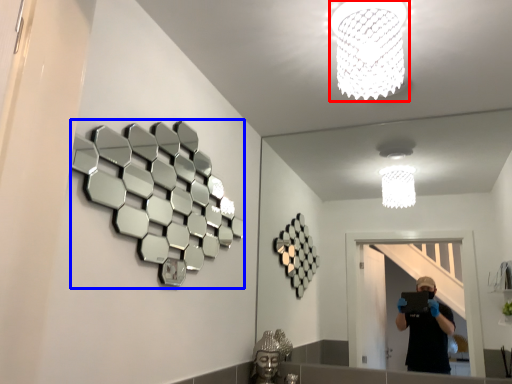
Question: Which of the following is the closest to the observer, lamp (highlighted by a red box) or mirror (highlighted by a blue box)?

Choices:
 (A) lamp
 (B) mirror

Answer: (B)